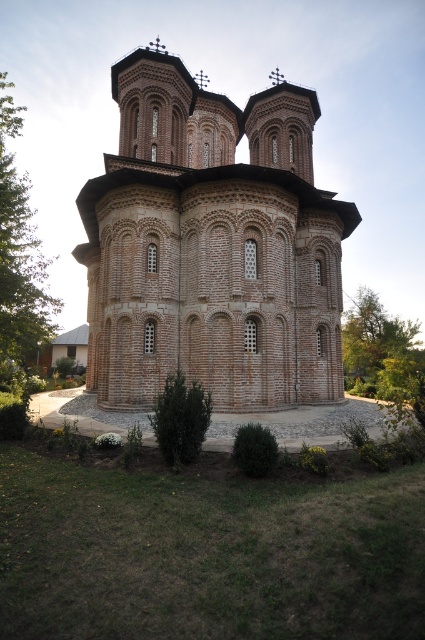
Question: Does green leafy tree at left appear over green leafy tree at right?

Choices:
 (A) yes
 (B) no

Answer: (A)

Question: Is brown brick church at center below green leafy tree at left?

Choices:
 (A) no
 (B) yes

Answer: (B)

Question: Does brown brick church at center have a larger size compared to green leafy tree at right?

Choices:
 (A) no
 (B) yes

Answer: (A)

Question: Which point is closer to the camera?

Choices:
 (A) brown brick church at center
 (B) green leafy tree at right
 (C) green leafy tree at left

Answer: (B)

Question: Which point is farther to the camera?

Choices:
 (A) (2, 278)
 (B) (356, 342)
 (C) (251, 180)

Answer: (B)

Question: Which object appears farthest from the camera in this image?

Choices:
 (A) brown brick church at center
 (B) green leafy tree at left

Answer: (B)